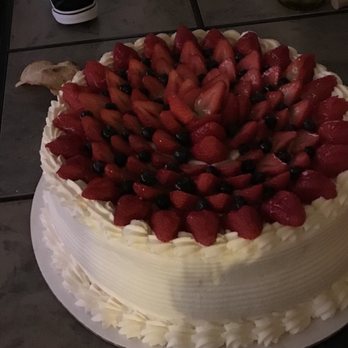
This screenshot has height=348, width=348. What are the coordinates of `table` in the screenshot? It's located at coord(53,331).